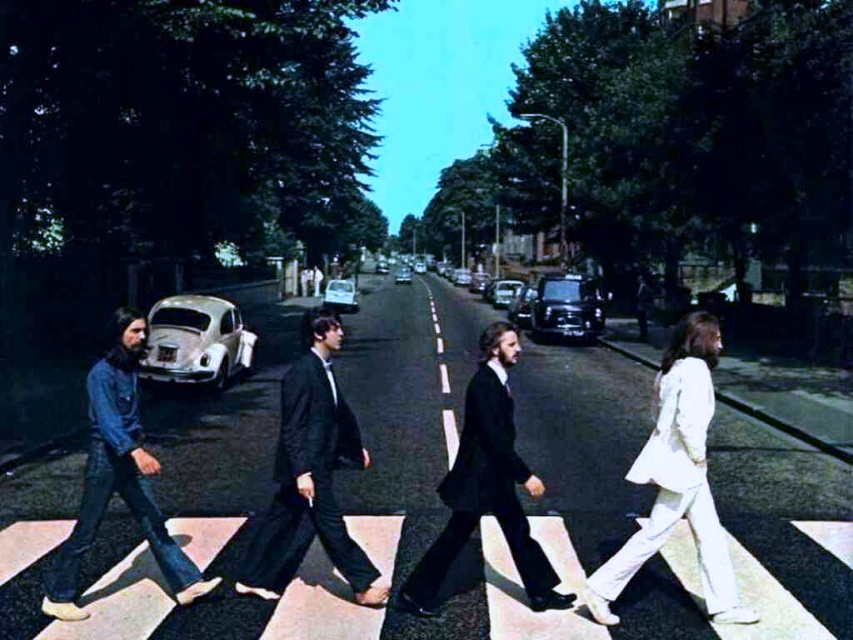
You are a photographer standing on the sidewalk across the street from the Abbey Road crossing. You want to take a photo of the two black suits at center. How far apart are the black textured suit at center and the black suit at center?

The black textured suit at center is 3.69 feet away from the black suit at center.

You are a photographer trying to capture the same shot as the famous Abbey Road cover. You notice two key figures in the scene, the black suit at center and the denim jacket at left. Based on their sizes in the image, which one should you position closer to the camera to maintain the original composition?

The black suit at center is smaller than the denim jacket at left, so to maintain the original composition, the black suit at center should be positioned closer to the camera to appear smaller in the photo.